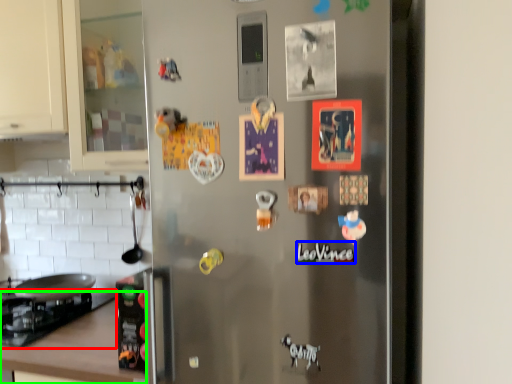
Question: Which is nearer to the gas stove (highlighted by a red box)? writing (highlighted by a blue box) or counter top (highlighted by a green box).

Choices:
 (A) writing
 (B) counter top

Answer: (B)